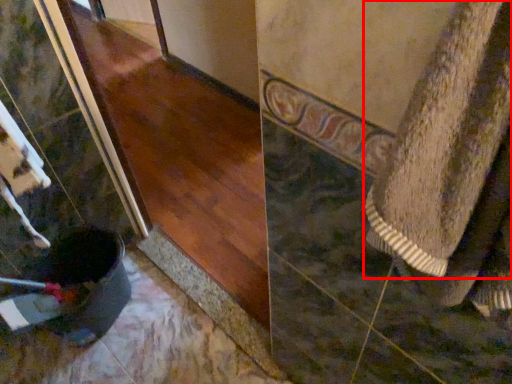
Question: From the image's perspective, where is towel (annotated by the red box) located in relation to wood in the image?

Choices:
 (A) above
 (B) below

Answer: (B)